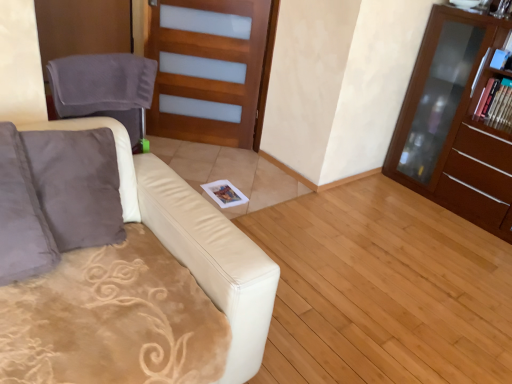
You are a GUI agent. You are given a task and a screenshot of the screen. Output one action in this format:
    pyautogui.click(x=<x>, y=<y>)
    Task: Click on the matte cardboard magazine at upper right
    The width and height of the screenshot is (512, 384).
    Given the screenshot: What is the action you would take?
    pyautogui.click(x=496, y=104)

Image resolution: width=512 pixels, height=384 pixels. Describe the element at coordinates (104, 88) in the screenshot. I see `gray fabric swivel chair at left` at that location.

Measure the distance between wooden frosted glass door at center and camera.

wooden frosted glass door at center is 9.18 feet away from camera.

The height and width of the screenshot is (384, 512). What do you see at coordinates (211, 70) in the screenshot?
I see `wooden frosted glass door at center` at bounding box center [211, 70].

Where is `matte cardboard magazine at upper right`? This screenshot has height=384, width=512. matte cardboard magazine at upper right is located at coordinates (496, 104).

From the image's perspective, which is below, matte cardboard magazine at upper right or light brown wood at center?

light brown wood at center.

Is matte cardboard magazine at upper right not within light brown wood at center?

matte cardboard magazine at upper right is positioned outside light brown wood at center.

From a real-world perspective, is matte cardboard magazine at upper right below light brown wood at center?

No, from a real-world perspective, matte cardboard magazine at upper right is not beneath light brown wood at center.

Between point (494, 102) and point (366, 228), which one is positioned behind?

Point (494, 102)

In the image, there is a wooden frosted glass door at center. Identify the location of hardwood below it (from the image's perspective). (383, 290).

From a real-world perspective, is light brown wood at center on wooden frosted glass door at center?

Actually, light brown wood at center is physically below wooden frosted glass door at center in the real world.

Which object is thinner, light brown wood at center or wooden frosted glass door at center?

With smaller width is wooden frosted glass door at center.

From their relative heights in the image, would you say light brown wood at center is taller or shorter than wooden frosted glass door at center?

In the image, light brown wood at center appears to be shorter than wooden frosted glass door at center.

From the image's perspective, is wooden frosted glass door at center above light brown wood at center?

Yes.

Considering the relative sizes of wooden frosted glass door at center and light brown wood at center in the image provided, is wooden frosted glass door at center thinner than light brown wood at center?

Correct, the width of wooden frosted glass door at center is less than that of light brown wood at center.

Can you see wooden frosted glass door at center touching light brown wood at center?

No.

Can you tell me how much wooden frosted glass door at center and light brown wood at center differ in facing direction?

The angle between the facing direction of wooden frosted glass door at center and the facing direction of light brown wood at center is 153 degrees.

From a real-world perspective, does matte cardboard magazine at upper right stand above brown wood cabinet at right?

Indeed, from a real-world perspective, matte cardboard magazine at upper right stands above brown wood cabinet at right.

Is matte cardboard magazine at upper right to the left of brown wood cabinet at right from the viewer's perspective?

In fact, matte cardboard magazine at upper right is to the right of brown wood cabinet at right.

How different are the orientations of matte cardboard magazine at upper right and brown wood cabinet at right in degrees?

The facing directions of matte cardboard magazine at upper right and brown wood cabinet at right are 5.29e-05 degrees apart.

Is point (490, 86) more distant than point (488, 129)?

Yes, point (490, 86) is farther from viewer.

In the image, is light brown wood at center positioned in front of or behind matte cardboard magazine at upper right?

light brown wood at center is positioned closer to the viewer than matte cardboard magazine at upper right.

Is light brown wood at center not close to matte cardboard magazine at upper right?

light brown wood at center is far away from matte cardboard magazine at upper right.

What's the angular difference between light brown wood at center and matte cardboard magazine at upper right's facing directions?

88.3 degrees.

Between light brown wood at center and matte cardboard magazine at upper right, which one has smaller width?

With smaller width is matte cardboard magazine at upper right.

From a real-world perspective, is blue glossy book at upper right under gray fabric swivel chair at left?

No, from a real-world perspective, blue glossy book at upper right is not under gray fabric swivel chair at left.

Considering the sizes of objects blue glossy book at upper right and gray fabric swivel chair at left in the image provided, who is wider, blue glossy book at upper right or gray fabric swivel chair at left?

blue glossy book at upper right.

Is light brown wood at center not inside blue glossy book at upper right?

Indeed, light brown wood at center is completely outside blue glossy book at upper right.

Where is `book on the right of light brown wood at center`? book on the right of light brown wood at center is located at coordinates (503, 54).

Between light brown wood at center and blue glossy book at upper right, which one appears on the right side from the viewer's perspective?

Positioned to the right is blue glossy book at upper right.

Is light brown wood at center closer to the viewer compared to blue glossy book at upper right?

That is True.

Identify the location of hardwood directly beneath the matte cardboard magazine at upper right (from a real-world perspective). This screenshot has height=384, width=512. tap(383, 290).

This screenshot has width=512, height=384. Identify the location of door on the left of the light brown wood at center. (211, 70).

From the image, which object appears to be nearer to matte cardboard magazine at upper right, light brown wood at center or brown wood cabinet at right?

brown wood cabinet at right is closer to matte cardboard magazine at upper right.

Looking at this image, estimate the real-world distances between objects in this image. Which object is closer to light brown wood at center, blue glossy book at upper right or matte cardboard magazine at upper right?

matte cardboard magazine at upper right.

From the picture: Based on their spatial positions, is brown wood cabinet at right or wooden frosted glass door at center further from matte cardboard magazine at upper right?

Among the two, wooden frosted glass door at center is located further to matte cardboard magazine at upper right.

From the image, which object appears to be nearer to brown wood cabinet at right, gray fabric swivel chair at left or matte cardboard magazine at upper right?

matte cardboard magazine at upper right lies closer to brown wood cabinet at right than the other object.

Looking at this image, looking at the image, which one is located closer to light brown wood at center, brown wood cabinet at right or blue glossy book at upper right?

Among the two, brown wood cabinet at right is located nearer to light brown wood at center.

When comparing their distances from light brown wood at center, does blue glossy book at upper right or brown wood cabinet at right seem further?

The object further to light brown wood at center is blue glossy book at upper right.

Which object lies further to the anchor point blue glossy book at upper right, wooden frosted glass door at center or brown wood cabinet at right?

wooden frosted glass door at center is further to blue glossy book at upper right.

When comparing their distances from blue glossy book at upper right, does wooden frosted glass door at center or gray fabric swivel chair at left seem further?

gray fabric swivel chair at left.

The width and height of the screenshot is (512, 384). What are the coordinates of `door between gray fabric swivel chair at left and brown wood cabinet at right from left to right` in the screenshot? It's located at (211, 70).

The image size is (512, 384). I want to click on cabinetry between blue glossy book at upper right and light brown wood at center vertically, so click(x=457, y=122).

Identify the location of book located between wooden frosted glass door at center and matte cardboard magazine at upper right in the left-right direction. Image resolution: width=512 pixels, height=384 pixels. click(503, 54).

At what (x,y) coordinates should I click in order to perform the action: click on hardwood between gray fabric swivel chair at left and brown wood cabinet at right. Please return your answer as a coordinate pair (x, y). The width and height of the screenshot is (512, 384). Looking at the image, I should click on coord(383,290).